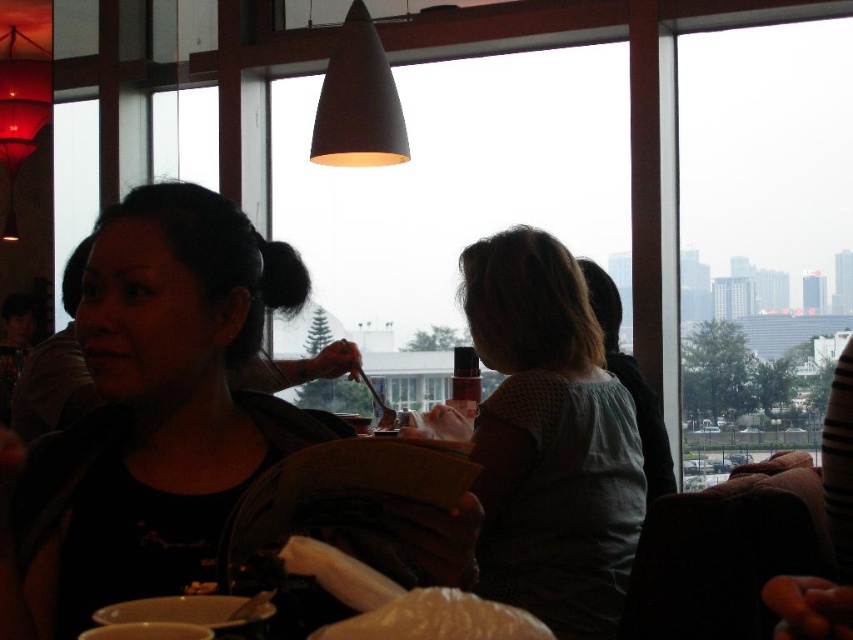
Question: Is matte black shirt at center above white fluffy bread at center?

Choices:
 (A) yes
 (B) no

Answer: (A)

Question: Can you confirm if matte black shirt at center is thinner than light blue cotton shirt at center?

Choices:
 (A) yes
 (B) no

Answer: (A)

Question: Which point appears farthest from the camera in this image?

Choices:
 (A) pos(508,632)
 (B) pos(229,451)
 (C) pos(763,429)
 (D) pos(509,449)

Answer: (C)

Question: Which object is farther from the camera taking this photo?

Choices:
 (A) transparent glass window at upper right
 (B) matte black shirt at center
 (C) light blue cotton shirt at center

Answer: (A)

Question: Is matte black shirt at center in front of white fluffy bread at center?

Choices:
 (A) yes
 (B) no

Answer: (B)

Question: Based on their relative distances, which object is farther from the transparent glass window at upper right?

Choices:
 (A) light blue cotton shirt at center
 (B) matte black shirt at center

Answer: (B)